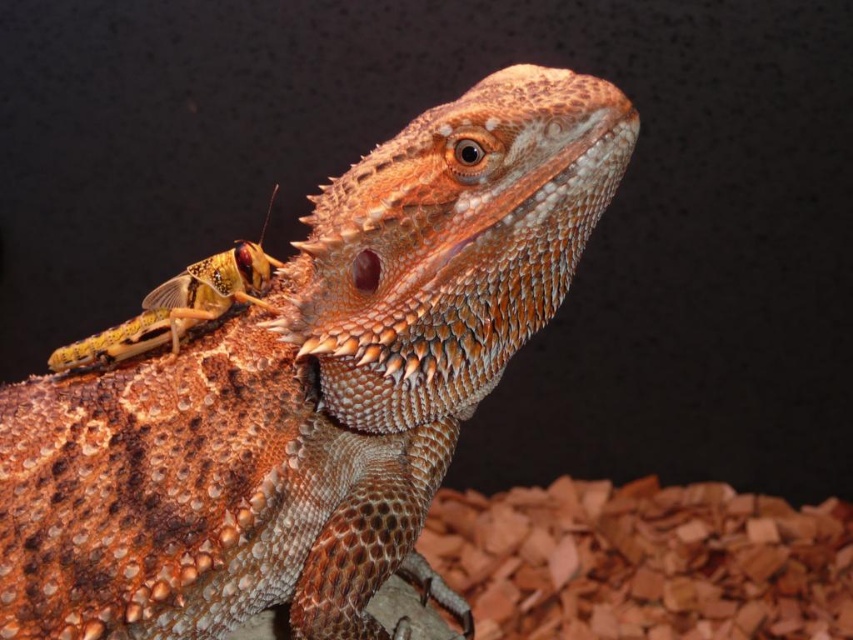
Question: Is shiny orange scales at upper center to the left of golden textured grasshopper at upper left from the viewer's perspective?

Choices:
 (A) no
 (B) yes

Answer: (A)

Question: Does shiny orange scales at upper center have a larger size compared to golden textured grasshopper at upper left?

Choices:
 (A) no
 (B) yes

Answer: (B)

Question: Can you confirm if shiny orange scales at upper center is wider than golden textured grasshopper at upper left?

Choices:
 (A) yes
 (B) no

Answer: (A)

Question: Which of the following is the closest to the observer?

Choices:
 (A) golden textured grasshopper at upper left
 (B) shiny orange scales at upper center

Answer: (B)